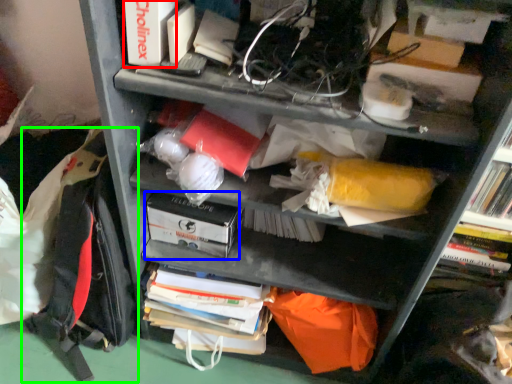
Question: Which object is positioned closest to paperback book (highlighted by a red box)? Select from paperback book (highlighted by a blue box) and backpack (highlighted by a green box).

Choices:
 (A) paperback book
 (B) backpack

Answer: (A)